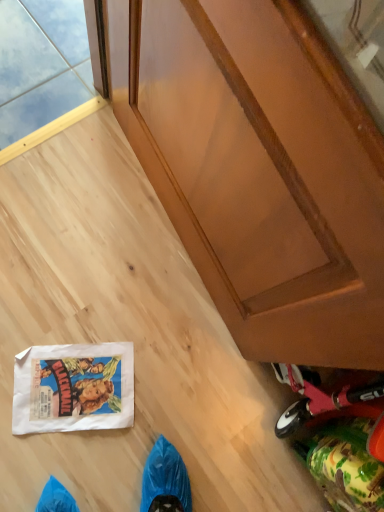
Identify the location of wooden door at center. The width and height of the screenshot is (384, 512). (260, 170).

Image resolution: width=384 pixels, height=512 pixels. What do you see at coordinates (260, 170) in the screenshot?
I see `wooden door at center` at bounding box center [260, 170].

This screenshot has height=512, width=384. Find the location of `wooden door at center`. wooden door at center is located at coordinates (260, 170).